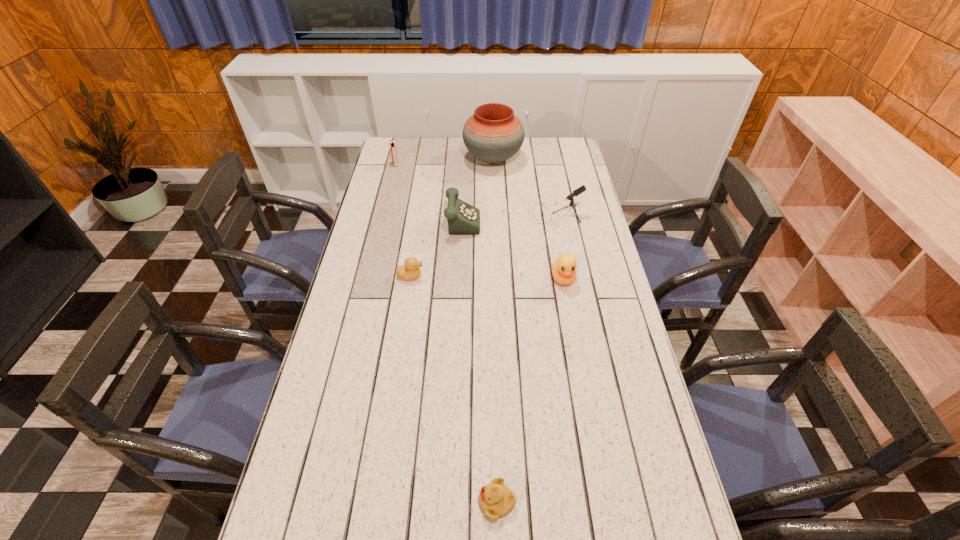
At what (x,y) coordinates should I click in order to perform the action: click on duckling that is the closest to the tallest duckling. Please return your answer as a coordinate pair (x, y). Looking at the image, I should click on (410, 270).